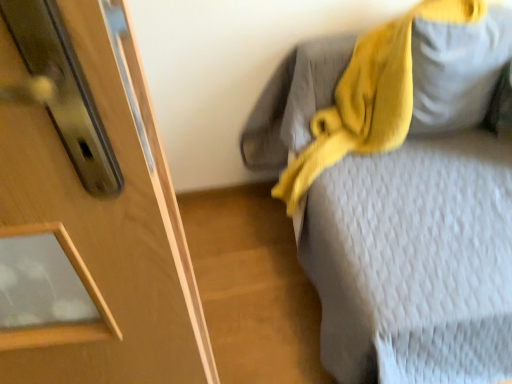
Question: Should I look upward or downward to see yellow knitted scarf at upper right?

Choices:
 (A) down
 (B) up

Answer: (B)

Question: Can you confirm if yellow knitted scarf at upper right is smaller than textured gray bed at upper right?

Choices:
 (A) no
 (B) yes

Answer: (B)

Question: Does yellow knitted scarf at upper right appear on the left side of textured gray bed at upper right?

Choices:
 (A) yes
 (B) no

Answer: (A)

Question: Is yellow knitted scarf at upper right positioned far away from textured gray bed at upper right?

Choices:
 (A) no
 (B) yes

Answer: (A)

Question: Is yellow knitted scarf at upper right outside of textured gray bed at upper right?

Choices:
 (A) no
 (B) yes

Answer: (A)

Question: Is the depth of yellow knitted scarf at upper right less than that of textured gray bed at upper right?

Choices:
 (A) yes
 (B) no

Answer: (B)

Question: From the image's perspective, is yellow knitted scarf at upper right located beneath textured gray bed at upper right?

Choices:
 (A) yes
 (B) no

Answer: (B)

Question: Does matte gray pillow at upper right have a smaller size compared to yellow knitted scarf at upper right?

Choices:
 (A) no
 (B) yes

Answer: (B)

Question: Can you confirm if matte gray pillow at upper right is positioned to the left of yellow knitted scarf at upper right?

Choices:
 (A) no
 (B) yes

Answer: (A)

Question: Is matte gray pillow at upper right not inside yellow knitted scarf at upper right?

Choices:
 (A) no
 (B) yes

Answer: (A)

Question: Is there a large distance between matte gray pillow at upper right and yellow knitted scarf at upper right?

Choices:
 (A) no
 (B) yes

Answer: (A)

Question: Does matte gray pillow at upper right appear on the right side of yellow knitted scarf at upper right?

Choices:
 (A) no
 (B) yes

Answer: (B)

Question: Is matte gray pillow at upper right facing away from yellow knitted scarf at upper right?

Choices:
 (A) yes
 (B) no

Answer: (A)

Question: Is textured gray bed at upper right positioned beyond the bounds of matte gray pillow at upper right?

Choices:
 (A) yes
 (B) no

Answer: (A)